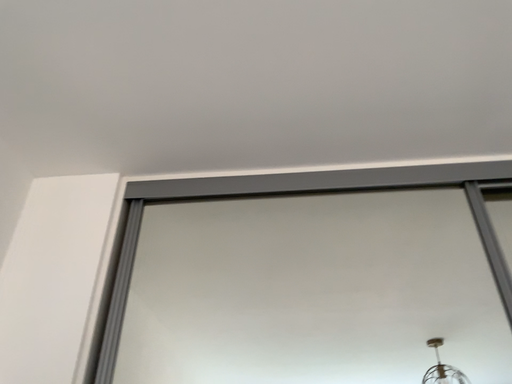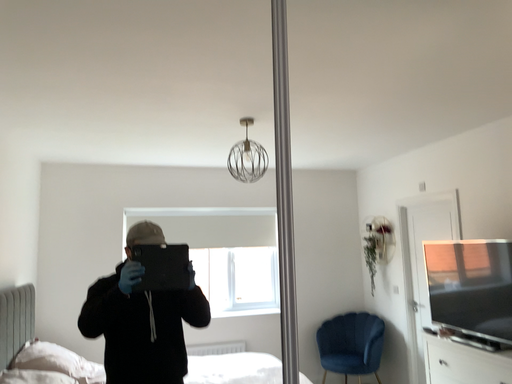
Question: Which way did the camera rotate in the video?

Choices:
 (A) rotated left
 (B) rotated right

Answer: (B)